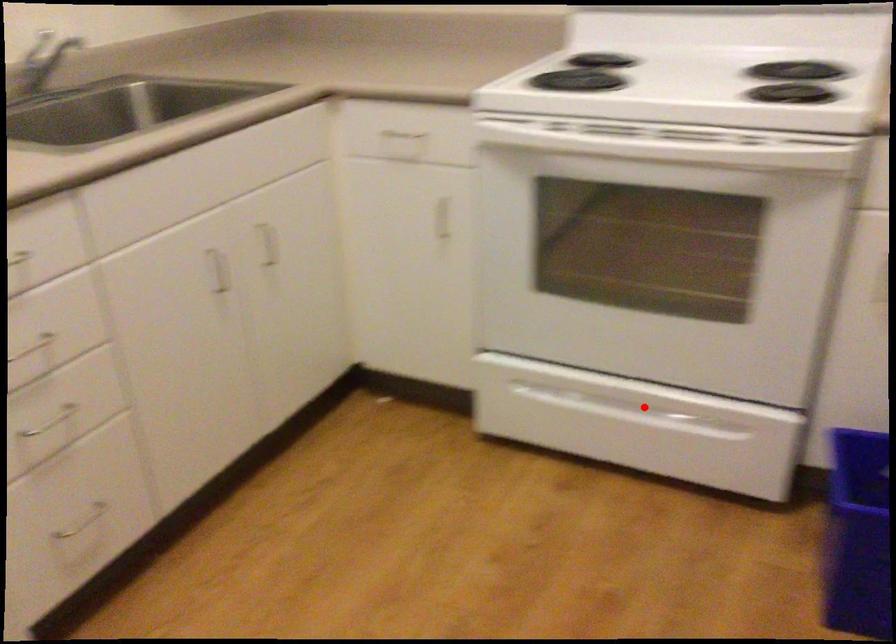
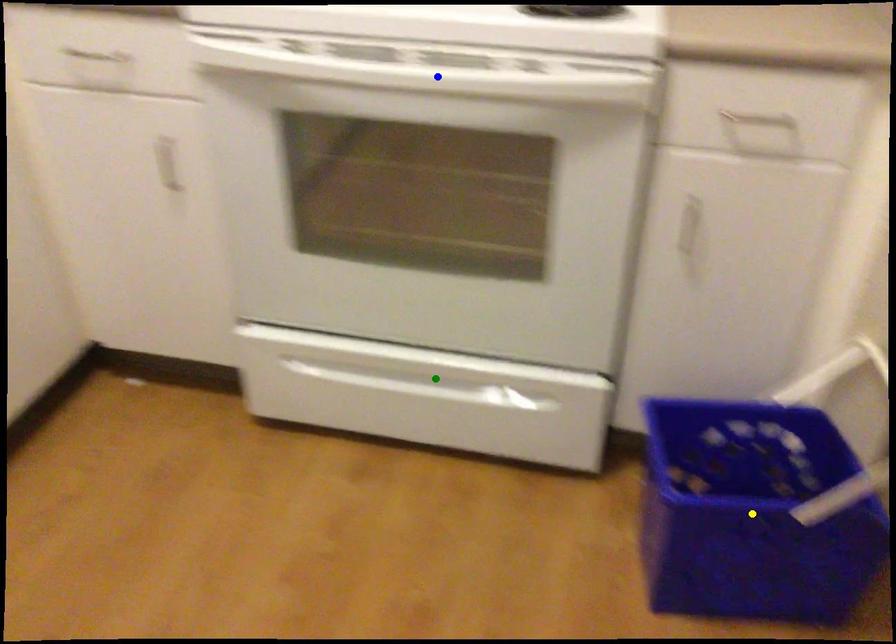
Question: I am providing you with two images of the same scene from different viewpoints. A red point is marked on the first image. You are given multiple points on the second image. Which mark in image 2 goes with the point in image 1?

Choices:
 (A) green point
 (B) yellow point
 (C) blue point

Answer: (A)